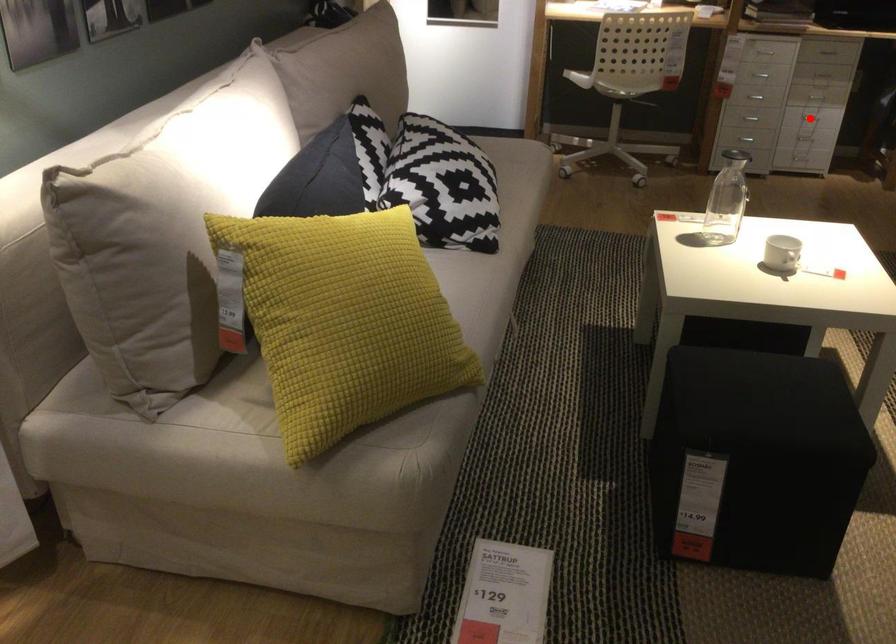
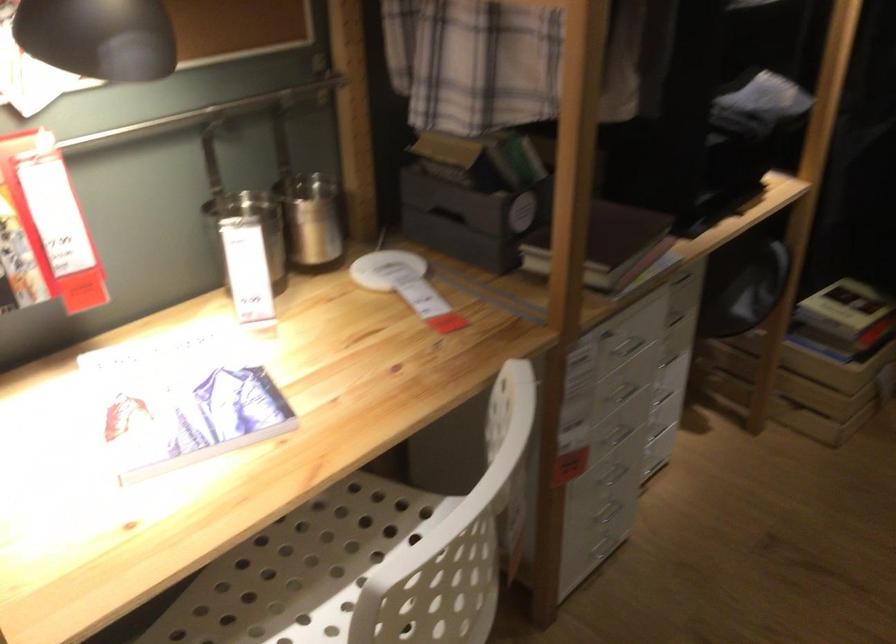
Question: I am providing you with two images of the same scene from different viewpoints. A red point is marked on the first image. Can you still see the location of the red point in image 2?

Choices:
 (A) Yes
 (B) No

Answer: (B)